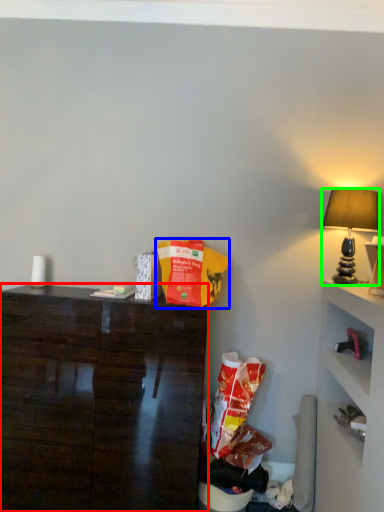
Question: Based on their relative distances, which object is nearer to desk (highlighted by a red box)? Choose from paper bag (highlighted by a blue box) and lamp (highlighted by a green box).

Choices:
 (A) paper bag
 (B) lamp

Answer: (A)